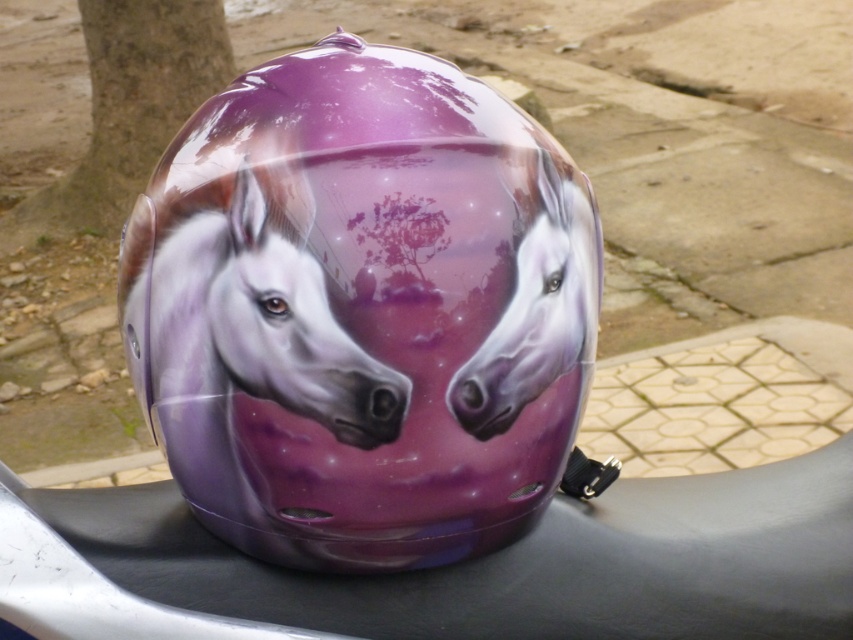
Is glossy purple helmet at center taller than glossy purple horse at center?

Yes.

Is point (316, 244) positioned in front of point (297, 320)?

Yes, point (316, 244) is in front of point (297, 320).

I want to click on glossy purple helmet at center, so click(363, 310).